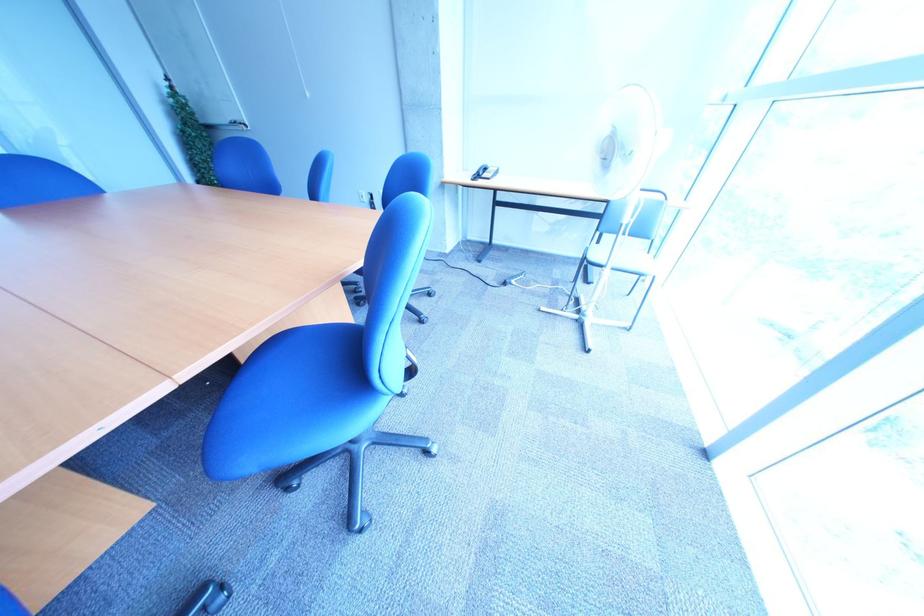
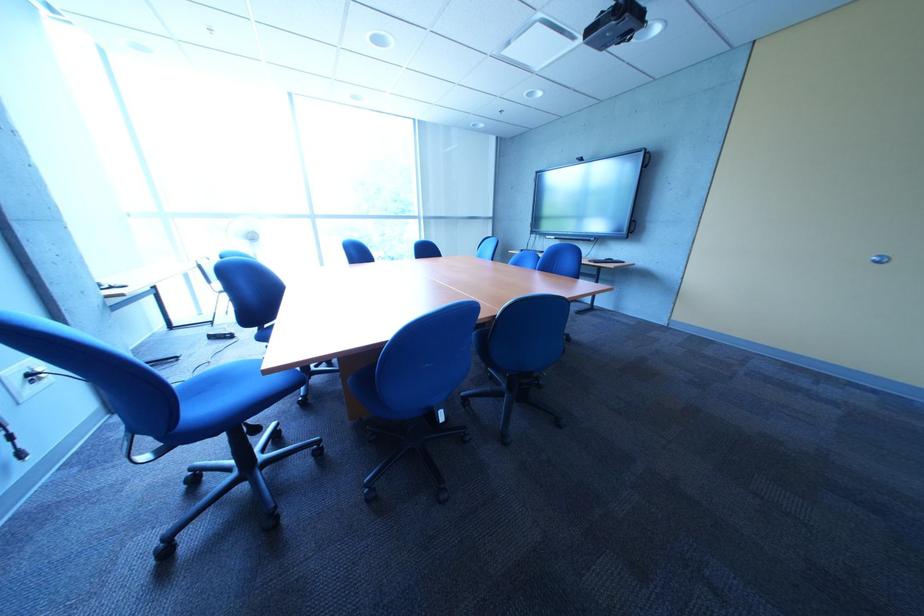
Question: I am providing you with two images of the same scene from different viewpoints. Which of the following objects are not visible in image2?

Choices:
 (A) red Puma box
 (B) round door handle
 (C) blue chair sitting surface
 (D) white standing fan

Answer: (D)